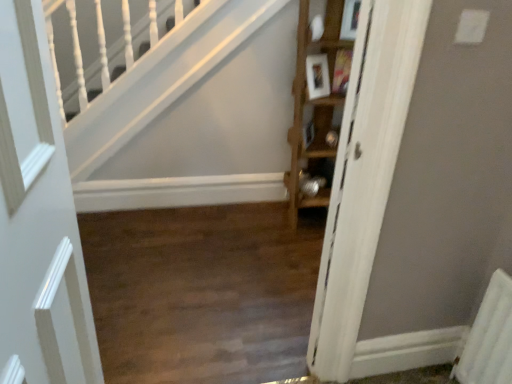
What is the approximate width of wooden floor at center?

wooden floor at center is 5.12 feet in width.

Where is `wooden floor at center`? wooden floor at center is located at coordinates (202, 292).

From the picture: Does white matte door at left lie behind wooden floor at center?

No.

Does white matte door at left contain wooden floor at center?

That's incorrect, wooden floor at center is not inside white matte door at left.

Is white matte door at left oriented towards wooden floor at center?

No, white matte door at left does not turn towards wooden floor at center.

Which is more to the right, wooden cabinet at right or wooden floor at center?

From the viewer's perspective, wooden cabinet at right appears more on the right side.

Is wooden floor at center at the back of wooden cabinet at right?

That's not correct — wooden cabinet at right is not looking away from wooden floor at center.

In terms of size, does wooden cabinet at right appear bigger or smaller than wooden floor at center?

In the image, wooden cabinet at right appears to be larger than wooden floor at center.

From the image's perspective, is wooden cabinet at right over wooden floor at center?

Yes.

From a real-world perspective, between wooden floor at center and wooden cabinet at right, who is vertically lower?

From a 3D spatial view, wooden floor at center is below.

Considering the sizes of objects wooden floor at center and wooden cabinet at right in the image provided, who is bigger, wooden floor at center or wooden cabinet at right?

wooden cabinet at right is bigger.

Between wooden floor at center and wooden cabinet at right, which one has more height?

wooden cabinet at right is taller.

From the image's perspective, is wooden floor at center located above or below wooden cabinet at right?

wooden floor at center is below wooden cabinet at right.

Is wooden cabinet at right turned away from white matte door at left?

That's not correct — wooden cabinet at right is not looking away from white matte door at left.

How distant is wooden cabinet at right from white matte door at left?

The distance of wooden cabinet at right from white matte door at left is 1.88 meters.

Find the location of `door located above the wooden cabinet at right (from a real-world perspective)`. door located above the wooden cabinet at right (from a real-world perspective) is located at coordinates (38, 219).

From a real-world perspective, is wooden cabinet at right physically located above or below white matte door at left?

wooden cabinet at right is situated lower than white matte door at left in the real world.

Between wooden floor at center and white matte door at left, which one is positioned in front?

white matte door at left is closer to the camera.

Would you say wooden floor at center is a long distance from white matte door at left?

No, there isn't a large distance between wooden floor at center and white matte door at left.

Is wooden floor at center situated inside white matte door at left or outside?

wooden floor at center is spatially situated outside white matte door at left.

From a real-world perspective, between white matte door at left and wooden cabinet at right, who is vertically higher?

In real-world perspective, white matte door at left is above.

Is white matte door at left next to wooden cabinet at right?

white matte door at left and wooden cabinet at right are not in contact.

Is white matte door at left thinner than wooden cabinet at right?

Indeed, white matte door at left has a lesser width compared to wooden cabinet at right.

Could you tell me if white matte door at left is facing wooden cabinet at right?

No, white matte door at left is not turned towards wooden cabinet at right.

The height and width of the screenshot is (384, 512). What are the coordinates of `corridor on the right of white matte door at left` in the screenshot? It's located at (202, 292).

Image resolution: width=512 pixels, height=384 pixels. Identify the location of corridor that appears below the wooden cabinet at right (from a real-world perspective). (202, 292).

Based on their spatial positions, is wooden floor at center or white matte door at left further from wooden cabinet at right?

white matte door at left lies further to wooden cabinet at right than the other object.

Estimate the real-world distances between objects in this image. Which object is closer to white matte door at left, wooden floor at center or wooden cabinet at right?

The object closer to white matte door at left is wooden floor at center.

Looking at this image, estimate the real-world distances between objects in this image. Which object is further from wooden cabinet at right, white matte door at left or wooden floor at center?

white matte door at left.

Which object lies further to the anchor point white matte door at left, wooden cabinet at right or wooden floor at center?

Based on the image, wooden cabinet at right appears to be further to white matte door at left.

Looking at the image, which one is located further to wooden floor at center, white matte door at left or wooden cabinet at right?

Based on the image, white matte door at left appears to be further to wooden floor at center.

From the picture: When comparing their distances from wooden floor at center, does wooden cabinet at right or white matte door at left seem further?

Among the two, white matte door at left is located further to wooden floor at center.

The height and width of the screenshot is (384, 512). Identify the location of corridor positioned between white matte door at left and wooden cabinet at right from near to far. (202, 292).